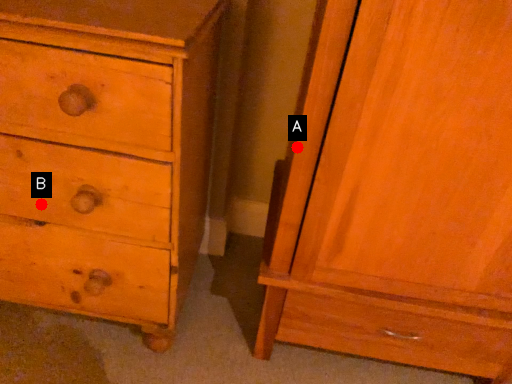
Question: Two points are circled on the image, labeled by A and B beside each circle. Which point is closer to the camera?

Choices:
 (A) A is closer
 (B) B is closer

Answer: (A)